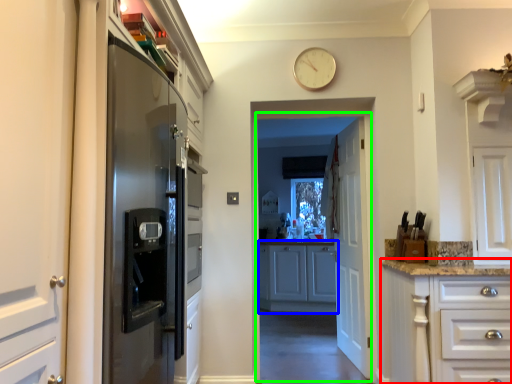
Question: Which is farther away from cabinetry (highlighted by a red box)? cabinetry (highlighted by a blue box) or corridor (highlighted by a green box)?

Choices:
 (A) cabinetry
 (B) corridor

Answer: (A)